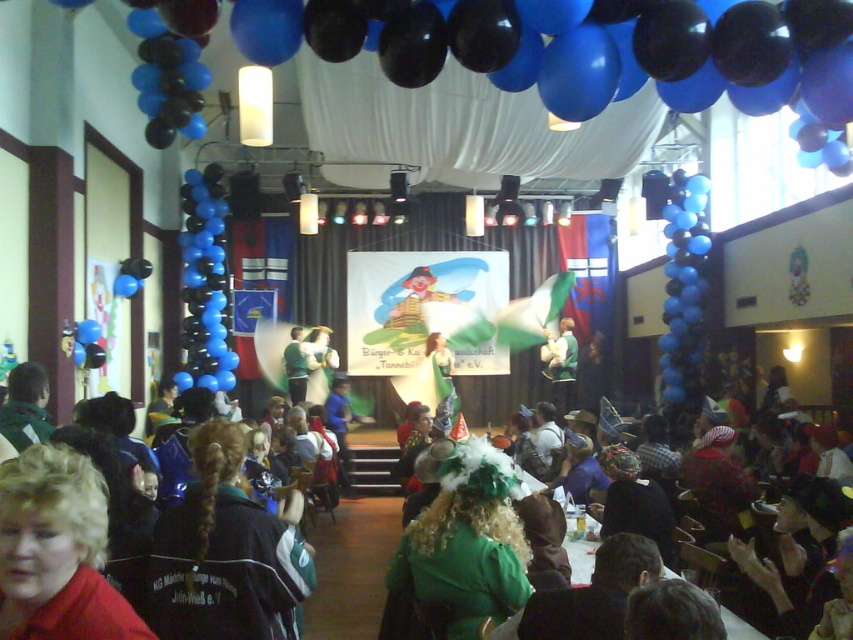
Question: Can you confirm if dark green fabric jacket at lower left is smaller than matte red shirt at lower left?

Choices:
 (A) no
 (B) yes

Answer: (A)

Question: Which is nearer to the white plastic table at lower right?

Choices:
 (A) green velvet dress at center
 (B) matte red shirt at lower left

Answer: (B)

Question: Estimate the real-world distances between objects in this image. Which object is farther from the dark brown hair at lower right?

Choices:
 (A) green fabric dress at lower center
 (B) dark green fabric jacket at lower left

Answer: (B)

Question: Considering the relative positions of dark green fabric jacket at lower left and green matte shirt at center in the image provided, where is dark green fabric jacket at lower left located with respect to green matte shirt at center?

Choices:
 (A) above
 (B) below

Answer: (B)

Question: Which object is the closest to the dark brown hair at lower right?

Choices:
 (A) dark green fabric jacket at lower left
 (B) black matte balloons at right

Answer: (A)

Question: Does dark green fabric jacket at lower left appear under green velvet hat at center?

Choices:
 (A) no
 (B) yes

Answer: (A)